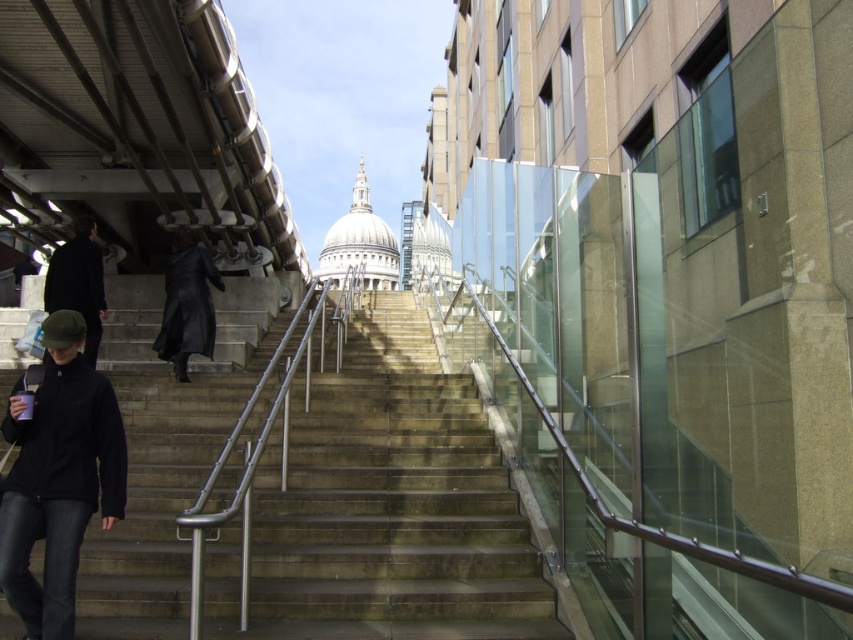
You are standing at the base of the staircase in the image and want to reach the historic building at the top. There are two points marked on the path ahead of you. The first point is at coordinate point(x=51, y=572) and the second is at point(x=181, y=243). Which point should you aim for first if you want to follow the path towards the building?

You should aim for point(x=51, y=572) first because it is in front of point(x=181, y=243) along the path towards the historic building.

You are a photographer standing at the bottom of the staircase in the image. You want to take a photo that includes both the black fleece jacket at lower left and the black leather coat at center. Which object should you adjust your camera angle to ensure both are in frame?

The black fleece jacket at lower left is below the black leather coat at center. To include both in the frame, you should angle your camera upwards to capture the black fleece jacket at lower left and the black leather coat at center simultaneously.